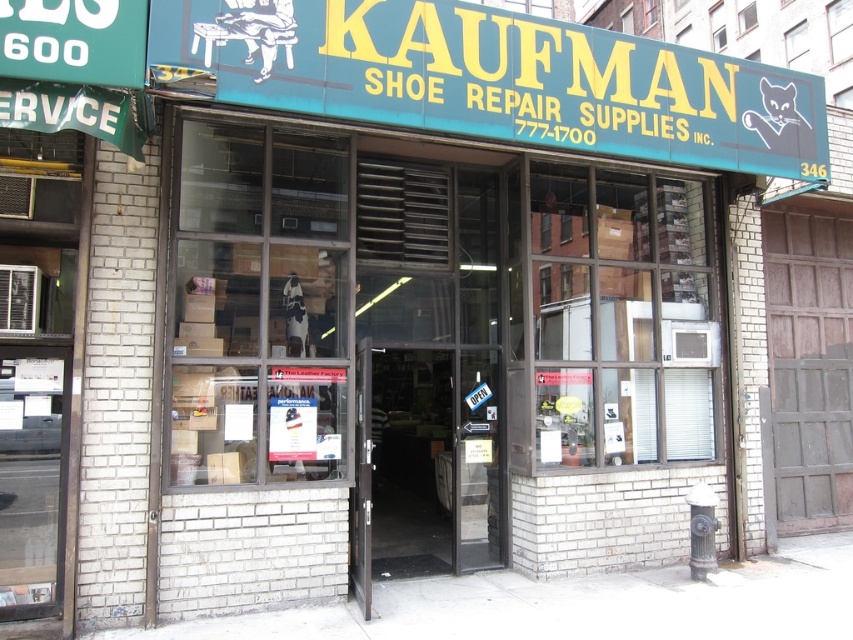
Question: Is teal/yellow signboard at upper center positioned at the back of transparent glass door at center?

Choices:
 (A) yes
 (B) no

Answer: (B)

Question: Is teal/yellow signboard at upper center positioned in front of transparent glass door at center?

Choices:
 (A) yes
 (B) no

Answer: (A)

Question: Which object appears closest to the camera in this image?

Choices:
 (A) teal/yellow signboard at upper center
 (B) transparent glass door at center

Answer: (A)

Question: From the image, what is the correct spatial relationship of teal/yellow signboard at upper center in relation to transparent glass door at center?

Choices:
 (A) above
 (B) below

Answer: (A)

Question: Which point is farther from the camera taking this photo?

Choices:
 (A) (285, 81)
 (B) (381, 355)

Answer: (B)